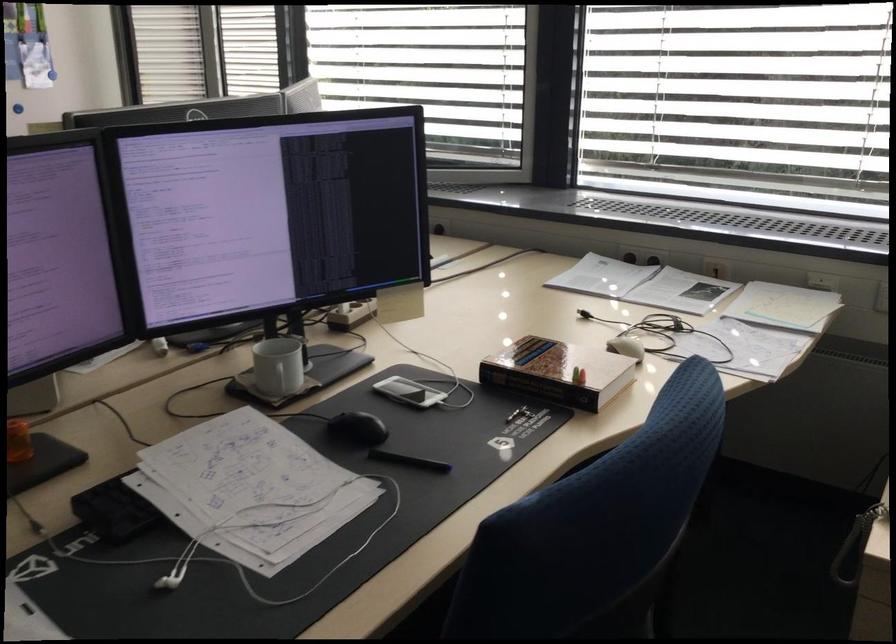
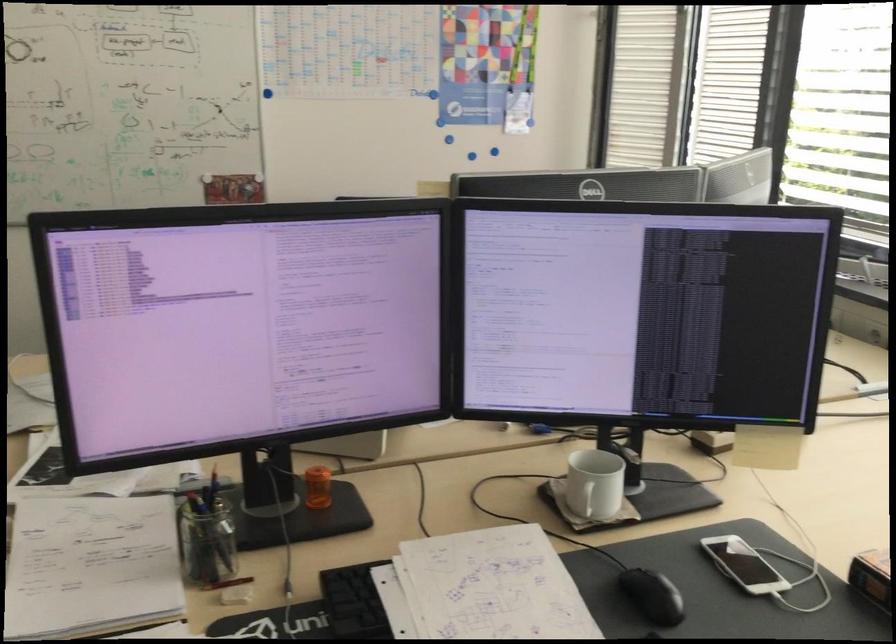
Find the pixel in the second image that matches (278,381) in the first image.

(583, 498)